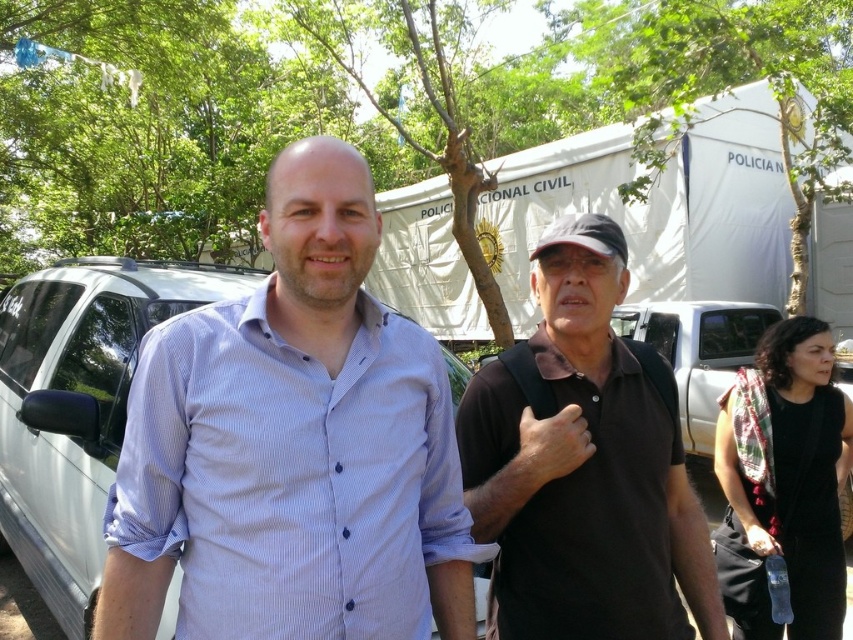
Between blue striped shirt at center and dry skin at center, which one is positioned lower?

blue striped shirt at center is lower down.

Who is taller, blue striped shirt at center or dry skin at center?

With more height is blue striped shirt at center.

Between point (430, 396) and point (564, 444), which one is positioned behind?

Positioned behind is point (564, 444).

Identify the location of blue striped shirt at center. (291, 476).

Between point (358, 604) and point (502, 564), which one is positioned in front?

Point (358, 604)

Is point (415, 628) farther from viewer compared to point (467, 419)?

No, it is not.

Locate an element on the screen. The height and width of the screenshot is (640, 853). blue striped shirt at center is located at coordinates (291, 476).

Between black matte polo shirt at center and dry skin at center, which one is positioned higher?

dry skin at center is above.

Is black matte polo shirt at center to the left of dry skin at center from the viewer's perspective?

Incorrect, black matte polo shirt at center is not on the left side of dry skin at center.

Where is `black matte polo shirt at center`? black matte polo shirt at center is located at coordinates (584, 468).

Find the location of `black matte polo shirt at center`. black matte polo shirt at center is located at coordinates (584, 468).